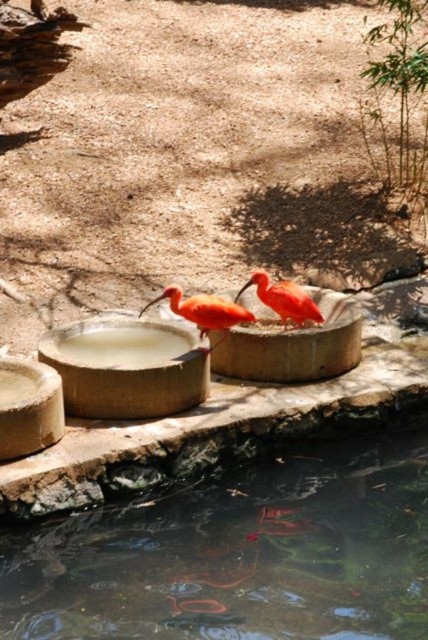
Is point (103, 362) more distant than point (139, 314)?

No, (103, 362) is closer to viewer.

Is smooth concrete basin at lower left to the left of orange matte ibis at center from the viewer's perspective?

Correct, you'll find smooth concrete basin at lower left to the left of orange matte ibis at center.

Between point (109, 355) and point (220, 316), which one is positioned behind?

The point (109, 355) is behind.

I want to click on smooth concrete basin at lower left, so click(x=125, y=368).

Who is taller, smooth concrete basin at lower left or bright orange bird at center?

smooth concrete basin at lower left is taller.

How distant is smooth concrete basin at lower left from bright orange bird at center?

smooth concrete basin at lower left is 1.04 meters from bright orange bird at center.

Describe the element at coordinates (125, 368) in the screenshot. I see `smooth concrete basin at lower left` at that location.

You are a GUI agent. You are given a task and a screenshot of the screen. Output one action in this format:
    pyautogui.click(x=<x>, y=<y>)
    Task: Click on the smooth concrete basin at lower left
    This screenshot has height=640, width=428.
    Given the screenshot: What is the action you would take?
    pyautogui.click(x=125, y=368)

Is clear water at pond center thinner than smooth concrete basin at lower left?

Incorrect, clear water at pond center's width is not less than smooth concrete basin at lower left's.

Is clear water at pond center wider than smooth concrete basin at lower left?

Correct, the width of clear water at pond center exceeds that of smooth concrete basin at lower left.

This screenshot has width=428, height=640. Identify the location of clear water at pond center. (238, 554).